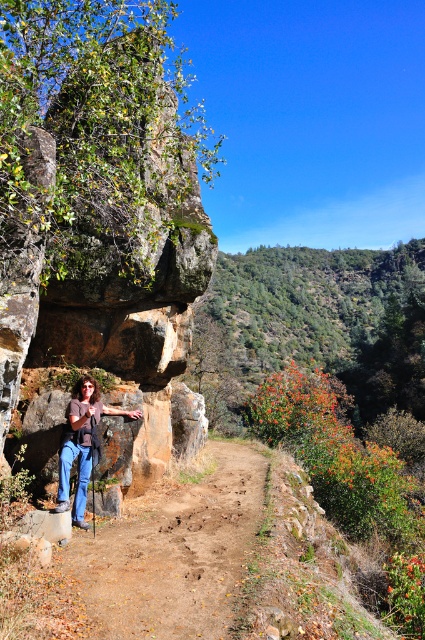
In the scene shown: You are a hiker standing at the center of the dirt path in the image. You want to take a photo of the brown rough rock at left. In which direction should you point your camera to capture it in the frame?

The brown rough rock at left is located at the 2D coordinates point (104,220), which means it is positioned to the left side of the dirt path. To capture it in your photo, you should point your camera to the left direction.

You are a hiker planning to walk along the dirt path at center. You want to know if the point at coordinates (172,554) is on the dirt path at center. Is it?

Yes, the point at coordinates (172,554) is on the dirt path at center.

You are a hiker trying to navigate the trail. Which object takes up more space in the image, the dirt path at center or the matte brown shirt at center?

The matte brown shirt at center takes up more space in the image than the dirt path at center.